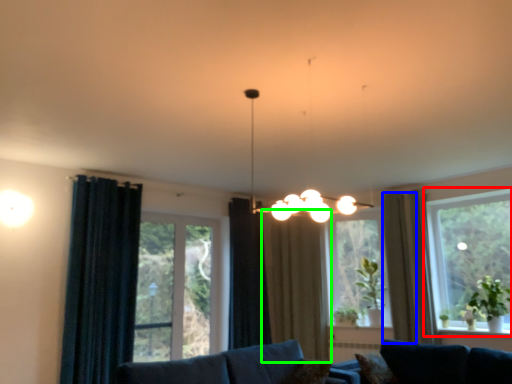
Question: Considering the real-world distances, which object is farthest from window (highlighted by a red box)? curtain (highlighted by a blue box) or curtain (highlighted by a green box)?

Choices:
 (A) curtain
 (B) curtain

Answer: (B)